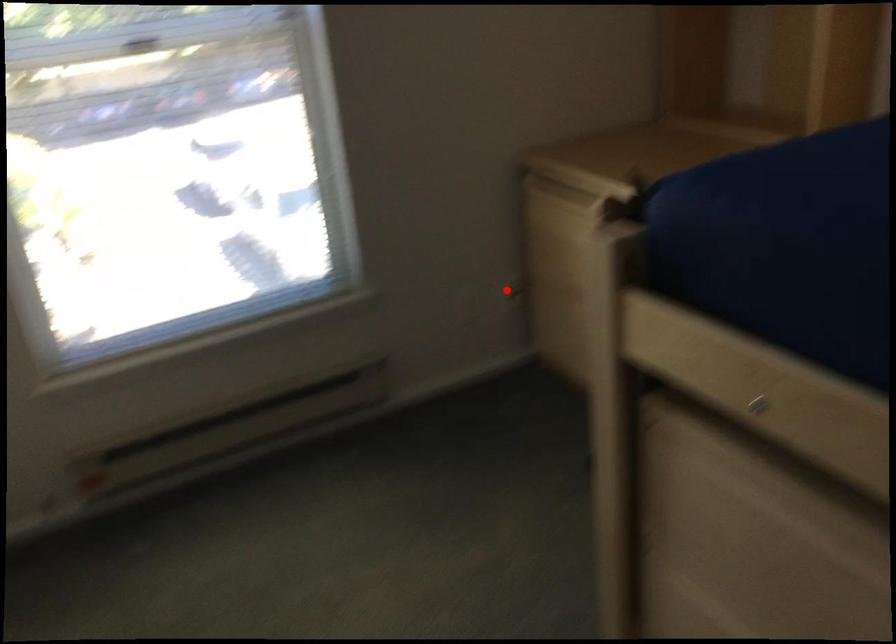
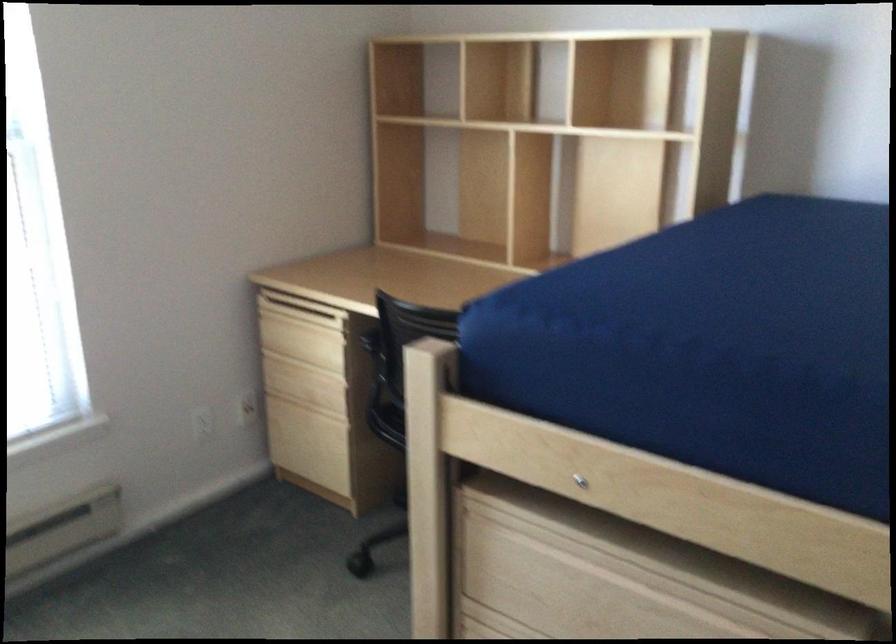
The point at the highlighted location is marked in the first image. Where is the corresponding point in the second image?

(246, 406)